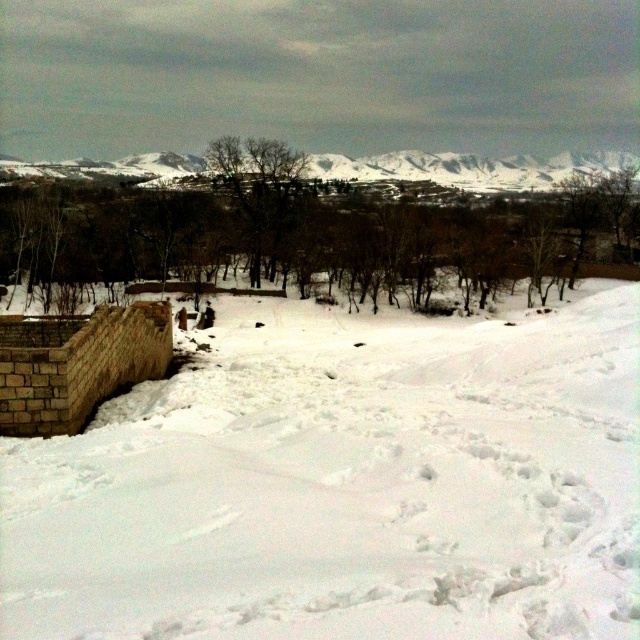
Can you confirm if white powdery snow at center is taller than snowy rocky mountain at upper center?

No, white powdery snow at center is not taller than snowy rocky mountain at upper center.

Can you confirm if white powdery snow at center is thinner than snowy rocky mountain at upper center?

Yes.

Between point (486, 524) and point (600, 164), which one is positioned in front?

Positioned in front is point (486, 524).

Locate an element on the screen. The image size is (640, 640). white powdery snow at center is located at coordinates (344, 483).

Does white powdery snow at center have a larger size compared to brown leafless trees at center?

No.

Measure the distance between white powdery snow at center and camera.

white powdery snow at center and camera are 5.46 meters apart from each other.

I want to click on white powdery snow at center, so click(x=344, y=483).

Who is taller, brown leafless trees at center or snowy rocky mountain at upper center?

brown leafless trees at center is taller.

Measure the distance from brown leafless trees at center to snowy rocky mountain at upper center.

A distance of 11.07 meters exists between brown leafless trees at center and snowy rocky mountain at upper center.

What are the coordinates of `brown leafless trees at center` in the screenshot? It's located at (320, 224).

The image size is (640, 640). What are the coordinates of `brown leafless trees at center` in the screenshot? It's located at (320, 224).